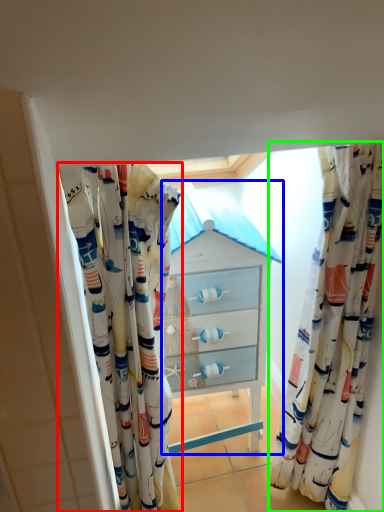
Question: Which is farther away from curtain (highlighted by a red box)? chest of drawers (highlighted by a blue box) or curtain (highlighted by a green box)?

Choices:
 (A) chest of drawers
 (B) curtain

Answer: (B)